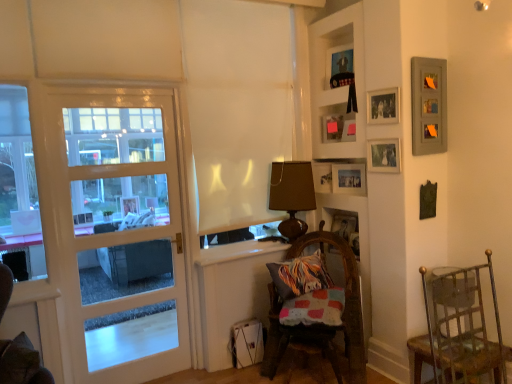
This screenshot has height=384, width=512. I want to click on wooden picture frame at upper right, which is counted as the 4th picture frame, starting from the top, so click(384, 155).

The height and width of the screenshot is (384, 512). What do you see at coordinates (383, 106) in the screenshot?
I see `wooden photo frame at upper right, positioned as the 5th picture frame in bottom-to-top order` at bounding box center [383, 106].

In order to face wooden photo frame at upper right, positioned as the 5th picture frame in bottom-to-top order, should I rotate leftwards or rightwards?

To align with it, rotate right about 16.705°.

Image resolution: width=512 pixels, height=384 pixels. What do you see at coordinates (329, 79) in the screenshot?
I see `white painted wood shelves at upper right` at bounding box center [329, 79].

Identify the location of white painted wood shelves at upper right. This screenshot has height=384, width=512. (329, 79).

The width and height of the screenshot is (512, 384). What do you see at coordinates (458, 327) in the screenshot?
I see `metallic/golden chair at right, arranged as the 1th chair when viewed from the front` at bounding box center [458, 327].

Where is `wooden picture frame at upper right, which is counted as the 4th picture frame, starting from the top`? This screenshot has width=512, height=384. wooden picture frame at upper right, which is counted as the 4th picture frame, starting from the top is located at coordinates (384, 155).

Considering the relative sizes of metallic silver picture frame at upper right, the fifth picture frame when ordered from top to bottom, and white painted wood shelves at upper right in the image provided, is metallic silver picture frame at upper right, the fifth picture frame when ordered from top to bottom, wider than white painted wood shelves at upper right?

In fact, metallic silver picture frame at upper right, the fifth picture frame when ordered from top to bottom, might be narrower than white painted wood shelves at upper right.

The image size is (512, 384). What are the coordinates of `cabinetry above the metallic silver picture frame at upper right, the fifth picture frame when ordered from top to bottom (from the image's perspective)` in the screenshot? It's located at (329, 79).

From a real-world perspective, is metallic silver picture frame at upper right, the 2th picture frame ordered from the bottom, physically located above or below white painted wood shelves at upper right?

Clearly, from a real-world perspective, metallic silver picture frame at upper right, the 2th picture frame ordered from the bottom, is below white painted wood shelves at upper right.

Is metallic silver picture frame at upper right, the fifth picture frame when ordered from top to bottom, next to white painted wood shelves at upper right?

metallic silver picture frame at upper right, the fifth picture frame when ordered from top to bottom, and white painted wood shelves at upper right are clearly separated.

Can you confirm if metallic/golden chair at right, which ranks as the 2th chair in back-to-front order, is positioned to the right of wooden picture frame at upper right, which is counted as the 4th picture frame, starting from the top?

Yes.

Is wooden picture frame at upper right, which is counted as the 4th picture frame, starting from the top, at the back of metallic/golden chair at right, which ranks as the 2th chair in back-to-front order?

That's not correct — metallic/golden chair at right, which ranks as the 2th chair in back-to-front order, is not looking away from wooden picture frame at upper right, which is counted as the 4th picture frame, starting from the top.

Does point (498, 315) come behind point (375, 148)?

No, (498, 315) is in front of (375, 148).

From the image's perspective, would you say matte wooden picture frame at upper center, the 6th picture frame positioned from the bottom, is shown under multicolored woven pillow at lower center?

No, from the image's perspective, matte wooden picture frame at upper center, the 6th picture frame positioned from the bottom, is not below multicolored woven pillow at lower center.

Considering the sizes of objects matte wooden picture frame at upper center, which is counted as the 1th picture frame, starting from the top, and multicolored woven pillow at lower center in the image provided, who is shorter, matte wooden picture frame at upper center, which is counted as the 1th picture frame, starting from the top, or multicolored woven pillow at lower center?

matte wooden picture frame at upper center, which is counted as the 1th picture frame, starting from the top.

From a real-world perspective, which object rests below the other?

multicolored woven pillow at lower center.

Which object is closer to the camera, wooden picture frame at upper right, the 3th picture frame ordered from the bottom, or gray matte picture frame at upper right, the third picture frame when ordered from top to bottom?

gray matte picture frame at upper right, the third picture frame when ordered from top to bottom, is in front.

From a real-world perspective, is wooden picture frame at upper right, the 3th picture frame ordered from the bottom, physically located above or below gray matte picture frame at upper right, the third picture frame when ordered from top to bottom?

In terms of real-world spatial position, wooden picture frame at upper right, the 3th picture frame ordered from the bottom, is below gray matte picture frame at upper right, the third picture frame when ordered from top to bottom.

Could you tell me if wooden picture frame at upper right, which is counted as the 4th picture frame, starting from the top, is facing gray matte picture frame at upper right, the third picture frame when ordered from top to bottom?

No, wooden picture frame at upper right, which is counted as the 4th picture frame, starting from the top, does not turn towards gray matte picture frame at upper right, the third picture frame when ordered from top to bottom.

Would you consider wooden picture frame at upper right, which is counted as the 4th picture frame, starting from the top, to be distant from gray matte picture frame at upper right, the third picture frame when ordered from top to bottom?

No, there isn't a large distance between wooden picture frame at upper right, which is counted as the 4th picture frame, starting from the top, and gray matte picture frame at upper right, the third picture frame when ordered from top to bottom.

Is woven wood chair at lower center, which is the 1th chair in back-to-front order, inside or outside of metallic silver picture frame at upper right, the fifth picture frame when ordered from top to bottom?

woven wood chair at lower center, which is the 1th chair in back-to-front order, is spatially situated outside metallic silver picture frame at upper right, the fifth picture frame when ordered from top to bottom.

From the image's perspective, which one is positioned lower, woven wood chair at lower center, the second chair from the front, or metallic silver picture frame at upper right, the fifth picture frame when ordered from top to bottom?

From the image's view, woven wood chair at lower center, the second chair from the front, is below.

Considering the sizes of objects woven wood chair at lower center, the second chair from the front, and metallic silver picture frame at upper right, the fifth picture frame when ordered from top to bottom, in the image provided, who is taller, woven wood chair at lower center, the second chair from the front, or metallic silver picture frame at upper right, the fifth picture frame when ordered from top to bottom,?

woven wood chair at lower center, the second chair from the front, is taller.

How many degrees apart are the facing directions of woven wood chair at lower center, which is the 1th chair in back-to-front order, and metallic silver picture frame at upper right, the fifth picture frame when ordered from top to bottom?

woven wood chair at lower center, which is the 1th chair in back-to-front order, and metallic silver picture frame at upper right, the fifth picture frame when ordered from top to bottom, are facing 59.4 degrees away from each other.

Considering the sizes of objects white glossy door at left and woven wood chair at lower center, the second chair from the front, in the image provided, who is smaller, white glossy door at left or woven wood chair at lower center, the second chair from the front,?

white glossy door at left is smaller.

Locate an element on the screen. The width and height of the screenshot is (512, 384). the 2nd chair positioned below the white glossy door at left (from a real-world perspective) is located at coordinates (321, 324).

Considering the positions of objects white glossy door at left and woven wood chair at lower center, the second chair from the front, in the image provided, who is in front, white glossy door at left or woven wood chair at lower center, the second chair from the front,?

woven wood chair at lower center, the second chair from the front, is in front.

Is multicolored woven pillow at lower center not within wooden picture frame at center, which appears as the sixth picture frame when viewed from the top?

Absolutely, multicolored woven pillow at lower center is external to wooden picture frame at center, which appears as the sixth picture frame when viewed from the top.

From a real-world perspective, is multicolored woven pillow at lower center below wooden picture frame at center, which appears as the sixth picture frame when viewed from the top?

Yes, from a real-world perspective, multicolored woven pillow at lower center is under wooden picture frame at center, which appears as the sixth picture frame when viewed from the top.

From the picture: Who is bigger, multicolored woven pillow at lower center or wooden picture frame at center, which appears as the sixth picture frame when viewed from the top?

Bigger between the two is multicolored woven pillow at lower center.

Image resolution: width=512 pixels, height=384 pixels. Find the location of `the 2nd picture frame counting from the right of the white painted wood shelves at upper right`. the 2nd picture frame counting from the right of the white painted wood shelves at upper right is located at coordinates (x=349, y=179).

You are a GUI agent. You are given a task and a screenshot of the screen. Output one action in this format:
    pyautogui.click(x=<x>, y=<y>)
    Task: Click on the picture frame that is the 3rd object located above the metallic/golden chair at right, which ranks as the 2th chair in back-to-front order (from the image's perspective)
    This screenshot has width=512, height=384.
    Given the screenshot: What is the action you would take?
    pyautogui.click(x=384, y=155)

From the image, which object appears to be nearer to white painted wood shelves at upper right, wooden picture frame at center, which appears as the sixth picture frame when viewed from the top, or brown fabric lampshade at center?

brown fabric lampshade at center.

Looking at the image, which one is located closer to brown fabric lampshade at center, metallic silver picture frame at upper right, the 2th picture frame ordered from the bottom, or white painted wood shelves at upper right?

Based on the image, metallic silver picture frame at upper right, the 2th picture frame ordered from the bottom, appears to be nearer to brown fabric lampshade at center.

When comparing their distances from woven wood chair at lower center, the second chair from the front, does white matte curtain at center or wooden picture frame at center, which appears as the sixth picture frame when viewed from the top, seem closer?

wooden picture frame at center, which appears as the sixth picture frame when viewed from the top, lies closer to woven wood chair at lower center, the second chair from the front, than the other object.

Considering their positions, is woven wood chair at lower center, which is the 1th chair in back-to-front order, positioned further to metallic/golden chair at right, arranged as the 1th chair when viewed from the front, than matte black couch at left?

matte black couch at left lies further to metallic/golden chair at right, arranged as the 1th chair when viewed from the front, than the other object.

Based on their spatial positions, is wooden picture frame at upper right, the 3th picture frame ordered from the bottom, or white matte curtain at center closer to matte black couch at left?

Based on the image, white matte curtain at center appears to be nearer to matte black couch at left.

Estimate the real-world distances between objects in this image. Which object is closer to white matte curtain at center, matte wooden picture frame at upper center, the 6th picture frame positioned from the bottom, or matte black couch at left?

Among the two, matte wooden picture frame at upper center, the 6th picture frame positioned from the bottom, is located nearer to white matte curtain at center.

Considering their positions, is white matte curtain at center positioned closer to matte black couch at left than wooden photo frame at upper right, positioned as the 5th picture frame in bottom-to-top order?

The object closer to matte black couch at left is white matte curtain at center.

From the image, which object appears to be farther from wooden photo frame at upper right, positioned as the 5th picture frame in bottom-to-top order, wooden picture frame at upper right, which is counted as the 4th picture frame, starting from the top, or white glossy door at left?

white glossy door at left.

Where is `chair between metallic/golden chair at right, arranged as the 1th chair when viewed from the front, and multicolored woven pillow at lower center in the front-back direction`? The height and width of the screenshot is (384, 512). chair between metallic/golden chair at right, arranged as the 1th chair when viewed from the front, and multicolored woven pillow at lower center in the front-back direction is located at coordinates (321, 324).

The image size is (512, 384). Identify the location of curtain positioned between metallic/golden chair at right, which ranks as the 2th chair in back-to-front order, and metallic silver picture frame at upper right, the 2th picture frame ordered from the bottom, from near to far. (237, 107).

The image size is (512, 384). In order to click on curtain between white glossy door at left and gray matte picture frame at upper right, the third picture frame when ordered from top to bottom, from left to right in this screenshot , I will do `click(237, 107)`.

You are a GUI agent. You are given a task and a screenshot of the screen. Output one action in this format:
    pyautogui.click(x=<x>, y=<y>)
    Task: Click on the chair between white glossy door at left and wooden photo frame at upper right, which is counted as the second picture frame, starting from the top
    Image resolution: width=512 pixels, height=384 pixels.
    Given the screenshot: What is the action you would take?
    pyautogui.click(x=321, y=324)